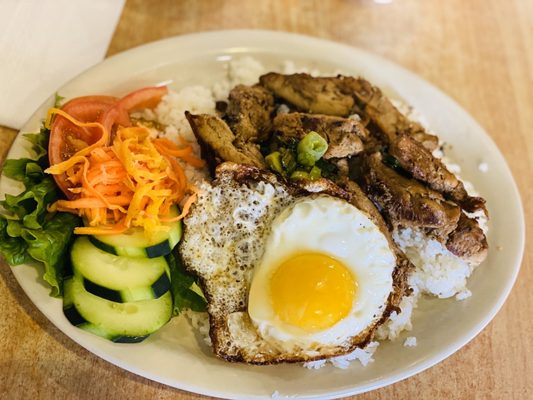
This screenshot has height=400, width=533. Identify the location of brown table. (174, 347).